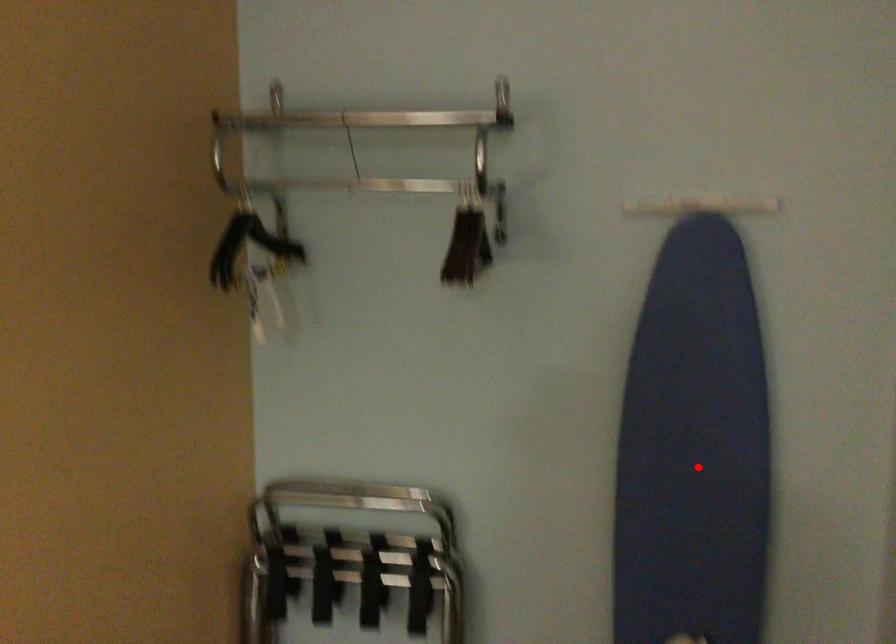
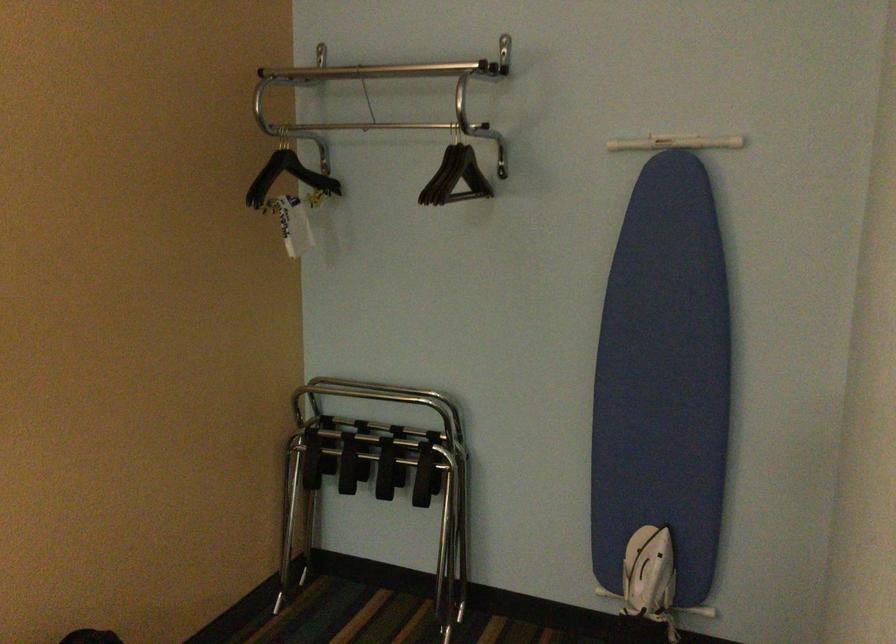
Question: I am providing you with two images of the same scene from different viewpoints. Image1 has a red point marked. In image2, the corresponding 3D location appears at what relative position? Reply with the corresponding letter.

Choices:
 (A) Closer
 (B) Farther

Answer: (B)